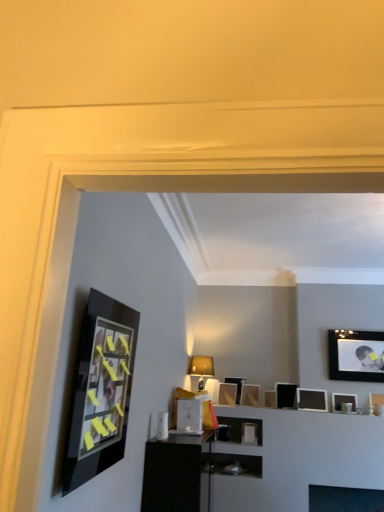
Describe the element at coordinates (376, 404) in the screenshot. I see `matte black picture frame at upper right, which is counted as the ninth picture frame, starting from the left` at that location.

What is the approximate width of matte black picture frame at upper right, the eighth picture frame viewed from the left?

It is 3.53 inches.

The image size is (384, 512). Describe the element at coordinates (176, 473) in the screenshot. I see `black glossy dresser at center` at that location.

The width and height of the screenshot is (384, 512). I want to click on matte black picture frame at left, acting as the 1th picture frame starting from the left, so click(x=100, y=390).

I want to click on matte black picture frame at center, which is counted as the seventh picture frame, starting from the right, so click(227, 394).

Is matte black picture frame at upper right, which is counted as the ninth picture frame, starting from the left, looking in the opposite direction of matte gold lampshade at center?

No, matte black picture frame at upper right, which is counted as the ninth picture frame, starting from the left, is not facing the opposite direction of matte gold lampshade at center.

Based on the photo, from the image's perspective, would you say matte black picture frame at upper right, which is counted as the ninth picture frame, starting from the left, is shown under matte gold lampshade at center?

Yes, from the image's perspective, matte black picture frame at upper right, which is counted as the ninth picture frame, starting from the left, is beneath matte gold lampshade at center.

Is matte black picture frame at upper right, which is counted as the ninth picture frame, starting from the left, surrounding matte gold lampshade at center?

No, matte gold lampshade at center is not inside matte black picture frame at upper right, which is counted as the ninth picture frame, starting from the left.

From a real-world perspective, is matte black picture frame at upper right, the first picture frame from the right, physically located above or below matte gold lampshade at center?

From a real-world perspective, matte black picture frame at upper right, the first picture frame from the right, is physically below matte gold lampshade at center.

Looking at this image, is matte black picture frame at center, which is the second picture frame from back to front, completely or partially inside matte black picture frame at upper right, acting as the 4th picture frame starting from the right?

No, matte black picture frame at center, which is the second picture frame from back to front, is not inside matte black picture frame at upper right, acting as the 4th picture frame starting from the right.

Which of these two, matte black picture frame at upper right, arranged as the fifth picture frame when viewed from the front, or matte black picture frame at center, which ranks as the 5th picture frame in right-to-left order, is thinner?

With smaller width is matte black picture frame at upper right, arranged as the fifth picture frame when viewed from the front.

Looking at this image, is matte black picture frame at upper right, arranged as the fifth picture frame when viewed from the front, turned away from matte black picture frame at center, the 5th picture frame viewed from the left?

matte black picture frame at upper right, arranged as the fifth picture frame when viewed from the front, does not have its back to matte black picture frame at center, the 5th picture frame viewed from the left.

Who is more distant, matte black picture frame at upper right, arranged as the fifth picture frame when viewed from the front, or matte black picture frame at center, marked as the eighth picture frame in a front-to-back arrangement?

Positioned behind is matte black picture frame at center, marked as the eighth picture frame in a front-to-back arrangement.

Are matte black picture frame at center, the 5th picture frame viewed from the left, and matte black picture frame at center, placed as the 1th picture frame when sorted from back to front, making contact?

No, matte black picture frame at center, the 5th picture frame viewed from the left, is not beside matte black picture frame at center, placed as the 1th picture frame when sorted from back to front.

From a real-world perspective, does matte black picture frame at center, the 5th picture frame viewed from the left, stand above matte black picture frame at center, which is the 9th picture frame in front-to-back order?

No, from a real-world perspective, matte black picture frame at center, the 5th picture frame viewed from the left, is not above matte black picture frame at center, which is the 9th picture frame in front-to-back order.

Do you think matte black picture frame at center, which is the second picture frame from back to front, is within matte black picture frame at center, the 4th picture frame in the left-to-right sequence, or outside of it?

matte black picture frame at center, which is the second picture frame from back to front, exists outside the volume of matte black picture frame at center, the 4th picture frame in the left-to-right sequence.

Is point (321, 399) closer to viewer compared to point (191, 403)?

No, (321, 399) is further to viewer.

From a real-world perspective, who is located higher, matte black picture frame at upper right, which is the fifth picture frame from back to front, or metallic silver picture frame at center, which is counted as the second picture frame, starting from the left?

In real-world perspective, matte black picture frame at upper right, which is the fifth picture frame from back to front, is above.

This screenshot has width=384, height=512. Find the location of `the 4th picture frame positioned above the metallic silver picture frame at center, which is counted as the 2th picture frame, starting from the front (from a real-world perspective)`. the 4th picture frame positioned above the metallic silver picture frame at center, which is counted as the 2th picture frame, starting from the front (from a real-world perspective) is located at coordinates (312, 399).

Between matte black picture frame at upper right, which is the fifth picture frame from back to front, and metallic silver picture frame at center, arranged as the eighth picture frame when viewed from the back, which one is positioned behind?

Positioned behind is matte black picture frame at upper right, which is the fifth picture frame from back to front.

Between matte black picture frame at upper right, which is counted as the ninth picture frame, starting from the left, and matte black picture frame at upper right, the 6th picture frame in the back-to-front sequence, which one appears on the left side from the viewer's perspective?

Positioned to the left is matte black picture frame at upper right, the 6th picture frame in the back-to-front sequence.

Choose the correct answer: Is matte black picture frame at upper right, marked as the 3th picture frame in a front-to-back arrangement, inside matte black picture frame at upper right, which ranks as the third picture frame in right-to-left order, or outside it?

matte black picture frame at upper right, marked as the 3th picture frame in a front-to-back arrangement, is not inside matte black picture frame at upper right, which ranks as the third picture frame in right-to-left order, it's outside.

How different are the orientations of matte black picture frame at upper right, the 7th picture frame when ordered from back to front, and matte black picture frame at upper right, the 6th picture frame in the back-to-front sequence, in degrees?

The angle between the facing direction of matte black picture frame at upper right, the 7th picture frame when ordered from back to front, and the facing direction of matte black picture frame at upper right, the 6th picture frame in the back-to-front sequence, is 3.05 degrees.

Does matte black picture frame at upper right, marked as the 3th picture frame in a front-to-back arrangement, have a greater height compared to matte black picture frame at upper right, which appears as the 4th picture frame when viewed from the front?

No, matte black picture frame at upper right, marked as the 3th picture frame in a front-to-back arrangement, is not taller than matte black picture frame at upper right, which appears as the 4th picture frame when viewed from the front.

From a real-world perspective, which picture frame is the 3rd one above the matte black picture frame at center, the 5th picture frame viewed from the left? Please provide its 2D coordinates.

[(356, 355)]

Looking at this image, which object is positioned more to the left, matte black picture frame at center, which is the second picture frame from back to front, or matte black picture frame at upper right, placed as the fourth picture frame when sorted from back to front?

Positioned to the left is matte black picture frame at center, which is the second picture frame from back to front.

Is point (245, 387) closer to camera compared to point (360, 377)?

That is False.

From the image's perspective, would you say matte black picture frame at center, marked as the eighth picture frame in a front-to-back arrangement, is shown under matte black picture frame at upper right, placed as the fourth picture frame when sorted from back to front?

Yes.

From a real-world perspective, is matte black picture frame at upper right, placed as the fourth picture frame when sorted from back to front, positioned above or below matte black picture frame at upper right, the first picture frame from the right?

matte black picture frame at upper right, placed as the fourth picture frame when sorted from back to front, is situated higher than matte black picture frame at upper right, the first picture frame from the right, in the real world.

Which object is positioned more to the right, matte black picture frame at upper right, which is the 2th picture frame in right-to-left order, or matte black picture frame at upper right, the 7th picture frame when ordered from back to front?

From the viewer's perspective, matte black picture frame at upper right, the 7th picture frame when ordered from back to front, appears more on the right side.

Locate an element on the screen. The height and width of the screenshot is (512, 384). the 6th picture frame located beneath the matte black picture frame at upper right, which is the 2th picture frame in right-to-left order (from a real-world perspective) is located at coordinates (376, 404).

Identify the location of picture frame that is the 6th one below the matte gold lampshade at center (from a real-world perspective). This screenshot has height=512, width=384. (376, 404).

The height and width of the screenshot is (512, 384). What are the coordinates of `the 1st picture frame counting from the left of the matte black picture frame at upper right, acting as the 4th picture frame starting from the right` in the screenshot? It's located at (250, 395).

Consider the image. When comparing their distances from matte black picture frame at upper right, which ranks as the third picture frame in right-to-left order, does matte black picture frame at upper right, the first picture frame from the right, or matte black picture frame at center, marked as the eighth picture frame in a front-to-back arrangement, seem closer?

Among the two, matte black picture frame at upper right, the first picture frame from the right, is located nearer to matte black picture frame at upper right, which ranks as the third picture frame in right-to-left order.

In the scene shown: When comparing their distances from black glass fireplace at lower center, does matte black picture frame at upper right, the 6th picture frame in the back-to-front sequence, or matte black picture frame at upper right, the 6th picture frame positioned from the front, seem further?

Based on the image, matte black picture frame at upper right, the 6th picture frame positioned from the front, appears to be further to black glass fireplace at lower center.

Based on their spatial positions, is matte black picture frame at upper right, the 6th picture frame in the back-to-front sequence, or metallic silver picture frame at center, arranged as the eighth picture frame when viewed from the back, further from matte black picture frame at upper right, the 6th picture frame positioned from the front?

metallic silver picture frame at center, arranged as the eighth picture frame when viewed from the back.

Considering their positions, is matte gold lampshade at center positioned further to matte black picture frame at center, positioned as the 6th picture frame in right-to-left order, than matte black picture frame at center, arranged as the 7th picture frame when viewed from the front?

matte gold lampshade at center lies further to matte black picture frame at center, positioned as the 6th picture frame in right-to-left order, than the other object.

When comparing their distances from black glossy dresser at center, does matte black picture frame at upper right, the seventh picture frame when ordered from left to right, or black glass fireplace at lower center seem closer?

black glass fireplace at lower center.

When comparing their distances from matte gold lampshade at center, does metallic silver picture frame at center, arranged as the eighth picture frame when viewed from the back, or black glass fireplace at lower center seem closer?

metallic silver picture frame at center, arranged as the eighth picture frame when viewed from the back.

Based on their spatial positions, is black glossy dresser at center or black glass fireplace at lower center further from matte black picture frame at upper right, the 7th picture frame when ordered from back to front?

The object further to matte black picture frame at upper right, the 7th picture frame when ordered from back to front, is black glossy dresser at center.

Considering their positions, is matte gold lampshade at center positioned further to black glass fireplace at lower center than matte black picture frame at center, the 4th picture frame in the left-to-right sequence?

matte gold lampshade at center lies further to black glass fireplace at lower center than the other object.

Find the location of a particular element. dresser positioned between matte black picture frame at left, which ranks as the 9th picture frame in right-to-left order, and matte black picture frame at upper right, the seventh picture frame when ordered from left to right, from near to far is located at coordinates (176, 473).

Where is `fireplace located between matte black picture frame at center, which ranks as the 5th picture frame in right-to-left order, and matte black picture frame at upper right, the 6th picture frame in the back-to-front sequence, in the left-right direction`? The width and height of the screenshot is (384, 512). fireplace located between matte black picture frame at center, which ranks as the 5th picture frame in right-to-left order, and matte black picture frame at upper right, the 6th picture frame in the back-to-front sequence, in the left-right direction is located at coordinates (345, 499).

This screenshot has width=384, height=512. In order to click on fireplace between black glossy dresser at center and matte black picture frame at center, which ranks as the 5th picture frame in right-to-left order, from front to back in this screenshot , I will do `click(345, 499)`.

The height and width of the screenshot is (512, 384). Find the location of `fireplace between matte black picture frame at left, acting as the 1th picture frame starting from the left, and matte black picture frame at upper right, which appears as the 4th picture frame when viewed from the front, along the z-axis`. fireplace between matte black picture frame at left, acting as the 1th picture frame starting from the left, and matte black picture frame at upper right, which appears as the 4th picture frame when viewed from the front, along the z-axis is located at coordinates (345, 499).